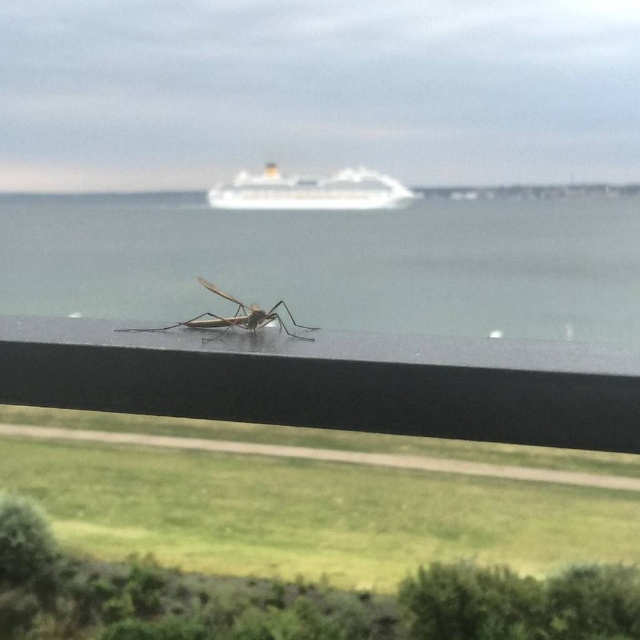
Question: Observing the image, what is the correct spatial positioning of white glossy ship at upper center in reference to translucent brown mosquito at center?

Choices:
 (A) right
 (B) left

Answer: (A)

Question: Is clear glass water at center positioned at the back of translucent brown mosquito at center?

Choices:
 (A) no
 (B) yes

Answer: (B)

Question: Which of the following is the farthest from the observer?

Choices:
 (A) (316, 200)
 (B) (268, 225)

Answer: (A)

Question: Among these objects, which one is farthest from the camera?

Choices:
 (A) white glossy ship at upper center
 (B) translucent brown mosquito at center
 (C) clear glass water at center

Answer: (A)

Question: Observing the image, what is the correct spatial positioning of white glossy ship at upper center in reference to translucent brown mosquito at center?

Choices:
 (A) left
 (B) right

Answer: (B)

Question: Based on their relative distances, which object is nearer to the clear glass water at center?

Choices:
 (A) translucent brown mosquito at center
 (B) white glossy ship at upper center

Answer: (B)